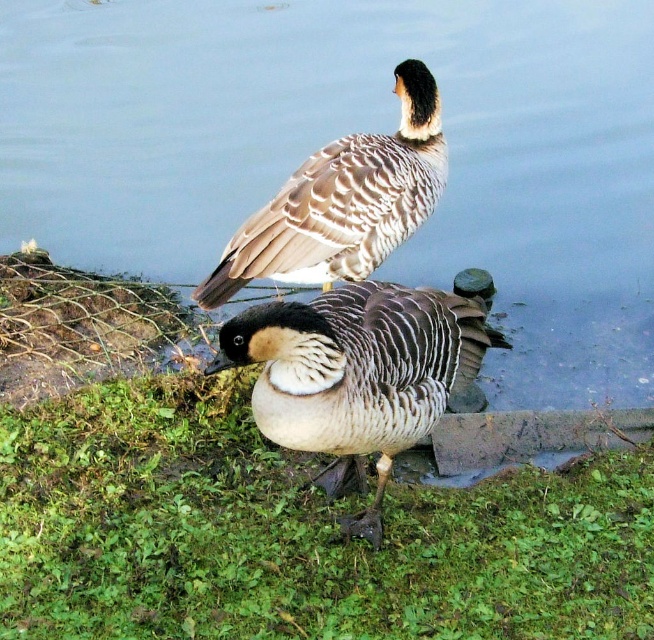
You are standing at the edge of the water and want to step onto the grassy bank. According to the image, where exactly is the green grass at lower center located?

The green grass at lower center is located at point (294, 532).

You are a birdwatcher trying to determine the relative sizes of the green grass at lower center and the brown speckled duck at upper center in the image. Which one is wider?

The green grass at lower center is wider than the brown speckled duck at upper center, as its width surpasses that of the duck.